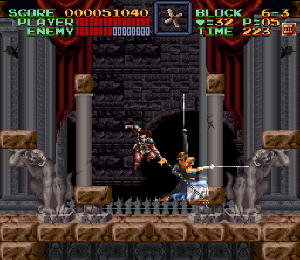
This screenshot has height=260, width=300. In order to click on pedestal statue on right in this screenshot , I will do [x=240, y=220].